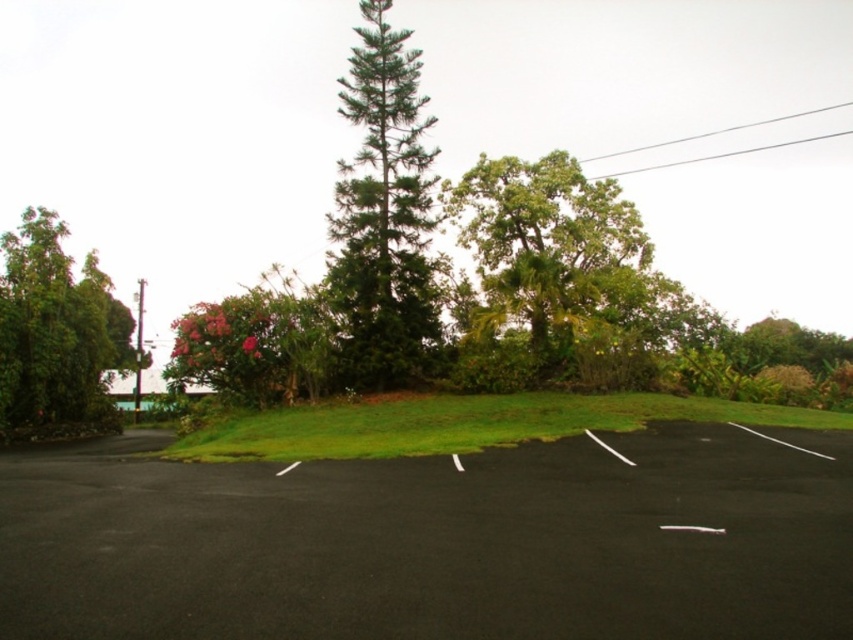
You are standing at the parking lot and want to walk towards the pine tree. There are two points marked on the path. Which point should you step on first, point (352, 488) or point (286, 358)?

You should step on point (352, 488) first because it is in front of point (286, 358) along your path towards the pine tree.